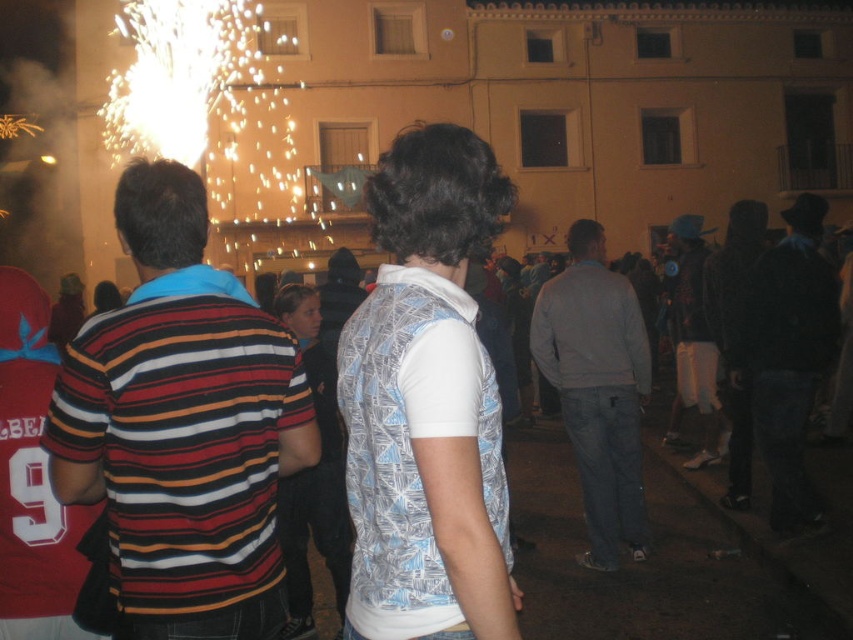
You are a photographer trying to capture a group photo of the light gray sweater at center and the white cotton shirt at center. Which clothing item should you focus on first if you want to ensure both are in frame without zooming in or out?

The light gray sweater at center is smaller than the white cotton shirt at center, so you should focus on the white cotton shirt at center first to ensure it fits in the frame before adjusting for the smaller light gray sweater at center.